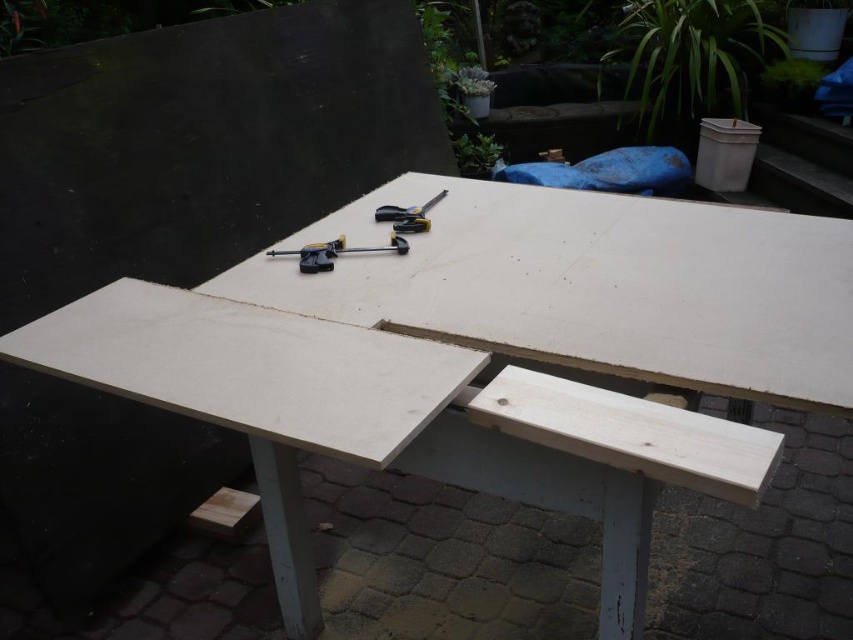
You are setting up a small workshop in your backyard and have both the natural wood picnic table at center and the metallic silver pliers at center. You need to place a large tool that requires 2 meters of width. Which object should you use for this task?

The natural wood picnic table at center might be wider than metallic silver pliers at center, so it is more suitable for placing the large tool that requires 2 meters of width.

You are standing at the origin point in the image. Where is the natural wood picnic table at center located in terms of coordinates?

The natural wood picnic table at center is located at coordinates 0.542 in the x direction and 0.556 in the y direction.

You are a contractor working on a project and need to place a heavy object on the table. The natural wood picnic table at center and the black plastic tool at center are in the way. Which object should you move to make space?

The natural wood picnic table at center is below the black plastic tool at center, so you should move the black plastic tool at center to make space on the table.